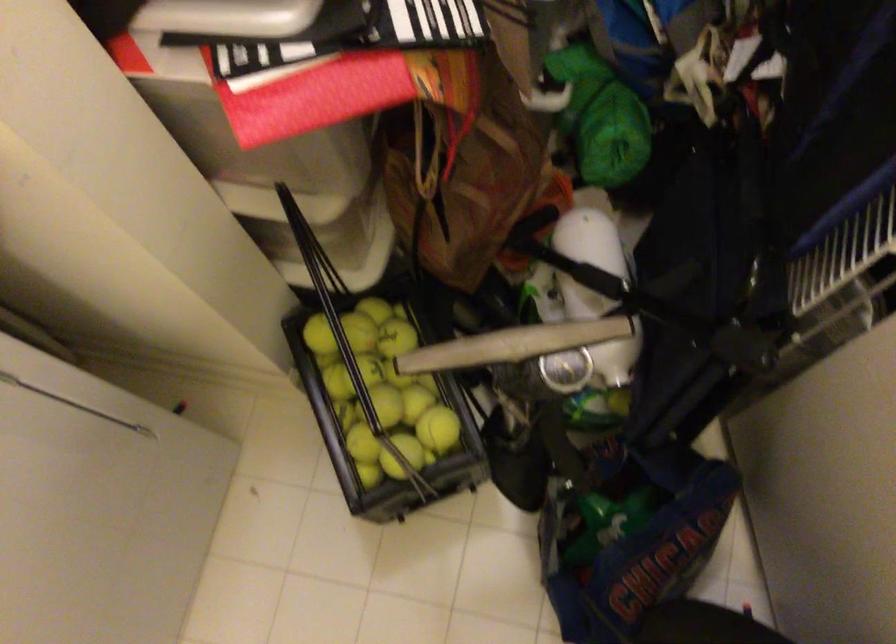
Find the location of a particular element. Image resolution: width=896 pixels, height=644 pixels. beige handle bar is located at coordinates (513, 345).